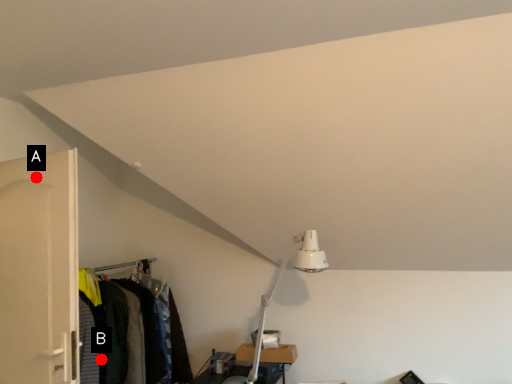
Question: Two points are circled on the image, labeled by A and B beside each circle. Which point is closer to the camera taking this photo?

Choices:
 (A) A is closer
 (B) B is closer

Answer: (A)